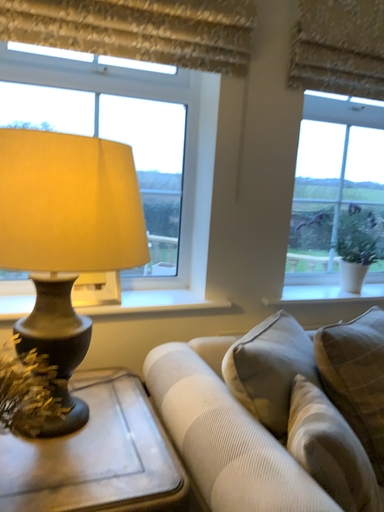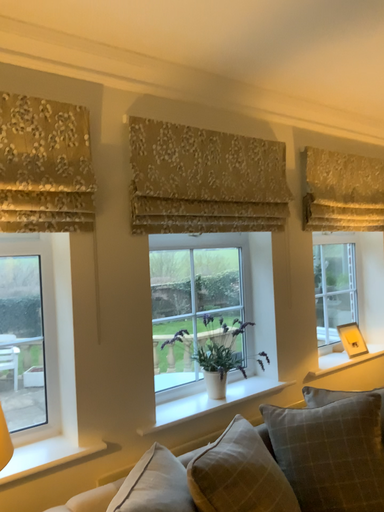
Question: How did the camera likely rotate when shooting the video?

Choices:
 (A) rotated upward
 (B) rotated downward

Answer: (A)